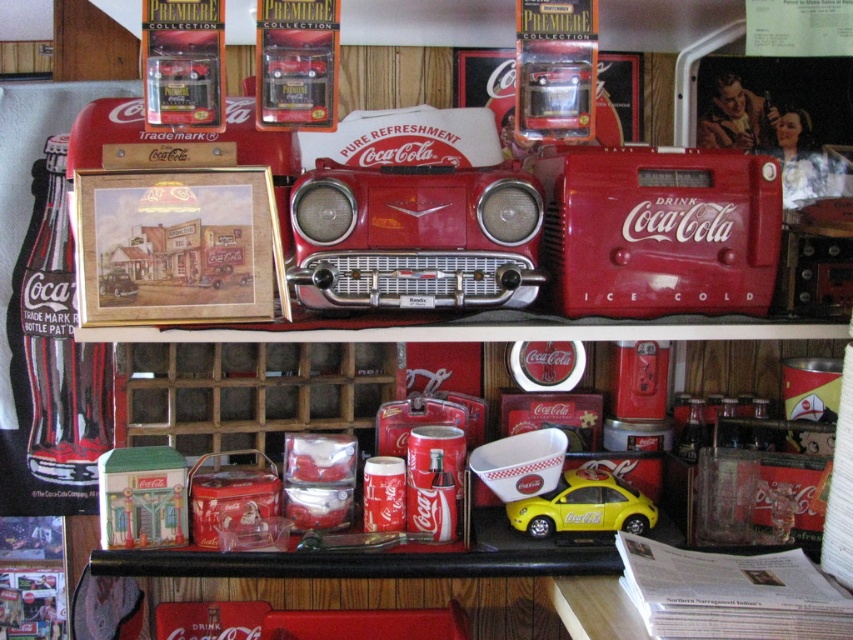
Question: Can you confirm if metallic red car at center is positioned to the right of matte tin building at center?

Choices:
 (A) yes
 (B) no

Answer: (A)

Question: Among these points, which one is nearest to the camera?

Choices:
 (A) (70, 252)
 (B) (413, 177)
 (C) (399, 524)

Answer: (B)

Question: Among these points, which one is nearest to the camera?

Choices:
 (A) (512, 225)
 (B) (45, 378)
 (C) (589, 528)

Answer: (A)

Question: Does matte tin building at center appear under yellow matte toy car at center?

Choices:
 (A) yes
 (B) no

Answer: (B)

Question: Which object is positioned closest to the yellow matte toy car at center?

Choices:
 (A) metallic red car at center
 (B) glossy plastic cup at center

Answer: (B)

Question: Can you confirm if metallic red car at center is positioned below yellow matte toy car at center?

Choices:
 (A) no
 (B) yes

Answer: (A)